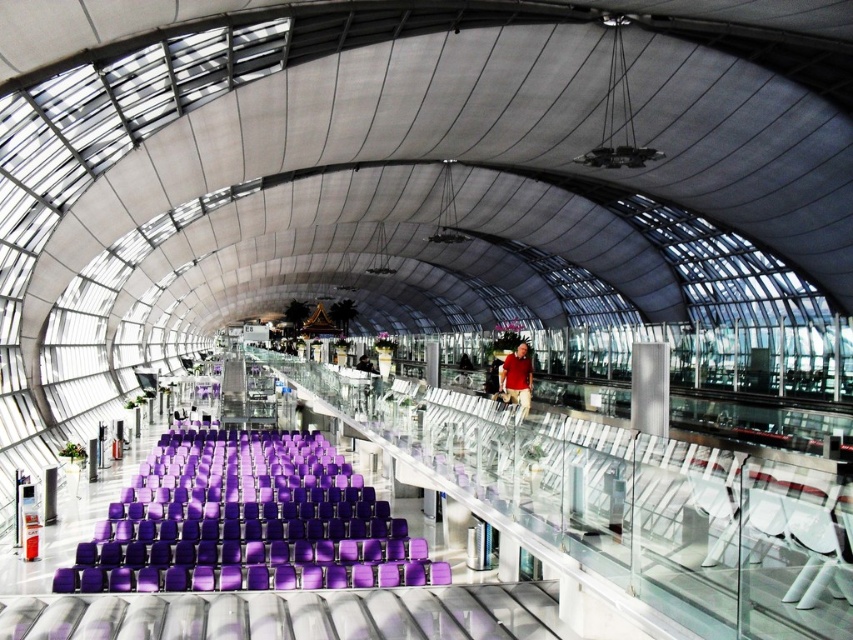
Does purple fabric chair at center come in front of matte black shirt at center?

Yes.

Does purple fabric chair at center have a greater width compared to matte black shirt at center?

Indeed, purple fabric chair at center has a greater width compared to matte black shirt at center.

Locate an element on the screen. This screenshot has width=853, height=640. purple fabric chair at center is located at coordinates 244,518.

Does purple fabric chair at center have a lesser height compared to red matte shirt at center?

Indeed, purple fabric chair at center has a lesser height compared to red matte shirt at center.

Which of these two, purple fabric chair at center or red matte shirt at center, stands shorter?

With less height is purple fabric chair at center.

Between point (299, 464) and point (527, 356), which one is positioned in front?

Point (527, 356) is in front.

Identify the location of purple fabric chair at center. (244, 518).

In the scene shown: Measure the distance between point (x=518, y=385) and camera.

They are 13.60 meters apart.

Is red matte shirt at center taller than matte black shirt at center?

Yes.

What do you see at coordinates (517, 378) in the screenshot? I see `red matte shirt at center` at bounding box center [517, 378].

This screenshot has width=853, height=640. Identify the location of red matte shirt at center. (517, 378).